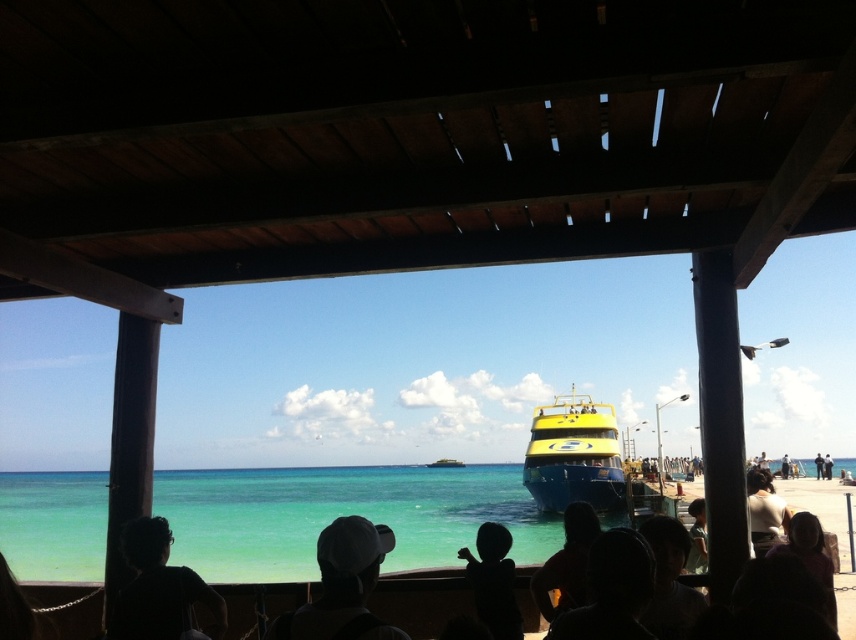
You are standing under the wooden structure and looking out towards the ocean. You notice the clear blue water at lower center and the dark purple shirt at lower right. Which of these two items takes up more space in the image?

The clear blue water at lower center takes up more space in the image because it is larger in size than the dark purple shirt at lower right.

You are standing on the wooden structure and want to take a photo of the clear blue water at lower center. According to the scene description, where should you aim your camera to capture it?

The clear blue water at lower center is located at the 2D coordinates point (x=342, y=515), so aim your camera there to capture it.

You are a photographer standing at the wooden structure, trying to capture a photo of both the black fabric headscarf at lower center and the dark purple shirt at lower right in the same frame. Given that your camera has a minimum focus distance of 1 meter, will you be able to focus on both subjects simultaneously?

The black fabric headscarf at lower center and dark purple shirt at lower right are 1.18 meters apart from each other. Since the distance between them is greater than the camera minimum focus distance of 1 meter, the photographer can focus on both subjects simultaneously.